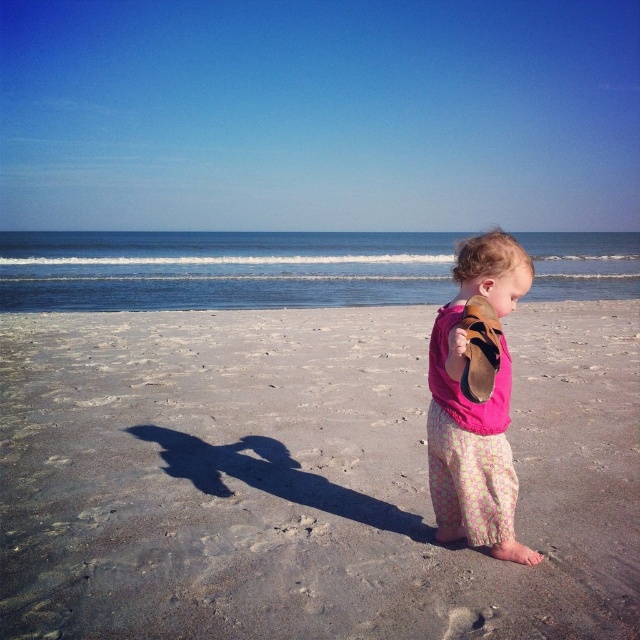
You are standing at the point marked as point (246, 358) on the beach. You want to walk directly towards the viewer. How far will you have to walk to reach the viewer?

You will have to walk 29.04 feet to reach the viewer because the distance between point (246, 358) and the viewer is 29.04 feet.